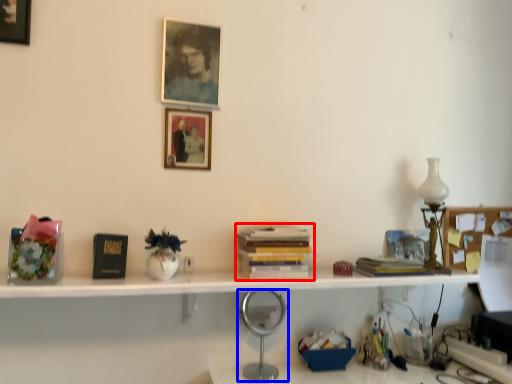
Question: Which of the following is the farthest to the observer, book (highlighted by a red box) or table lamp (highlighted by a blue box)?

Choices:
 (A) book
 (B) table lamp

Answer: (B)